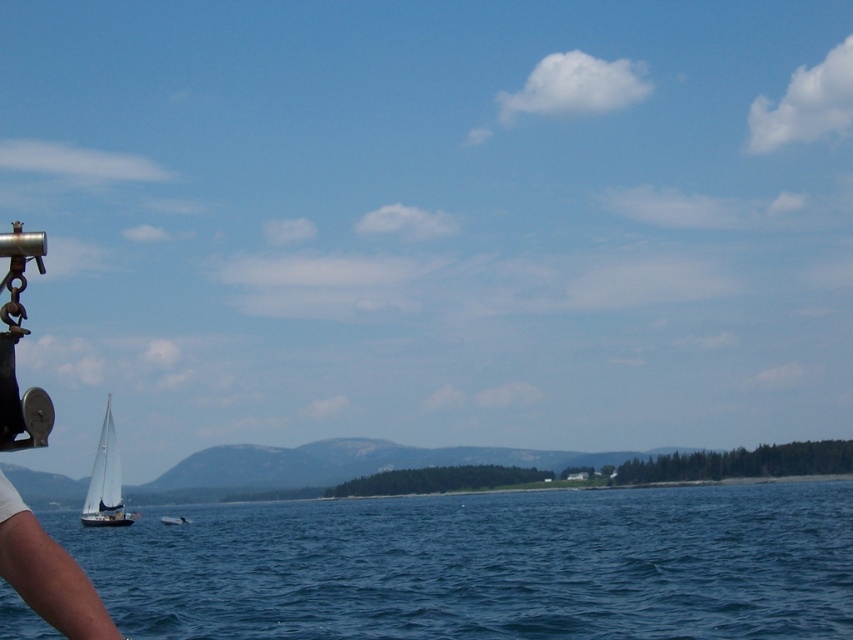
You are on a boat and see the point marked at coordinates (105, 481). What object is located at that point?

The point at coordinates 0.753, 0.123 indicates the white matte sailboat at left.

You are a photographer on a boat trying to capture a photo of two specific points in the scene. The first point is at coordinates point (599, 524) and the second is at point (184, 518). From your perspective, which point appears closer to you in the photo?

Point (599, 524) is closer to the camera than point (184, 518), so it will appear closer in the photo.